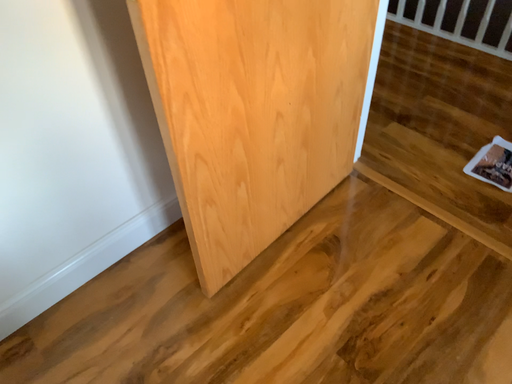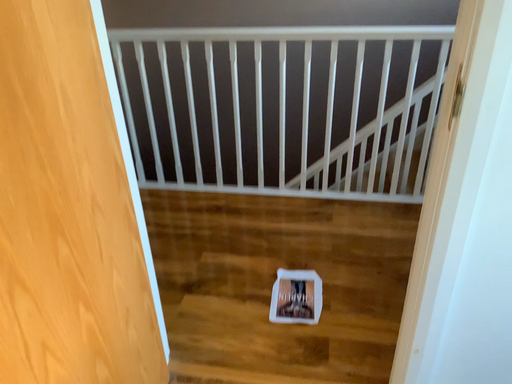
Question: How did the camera likely rotate when shooting the video?

Choices:
 (A) rotated left
 (B) rotated right

Answer: (B)